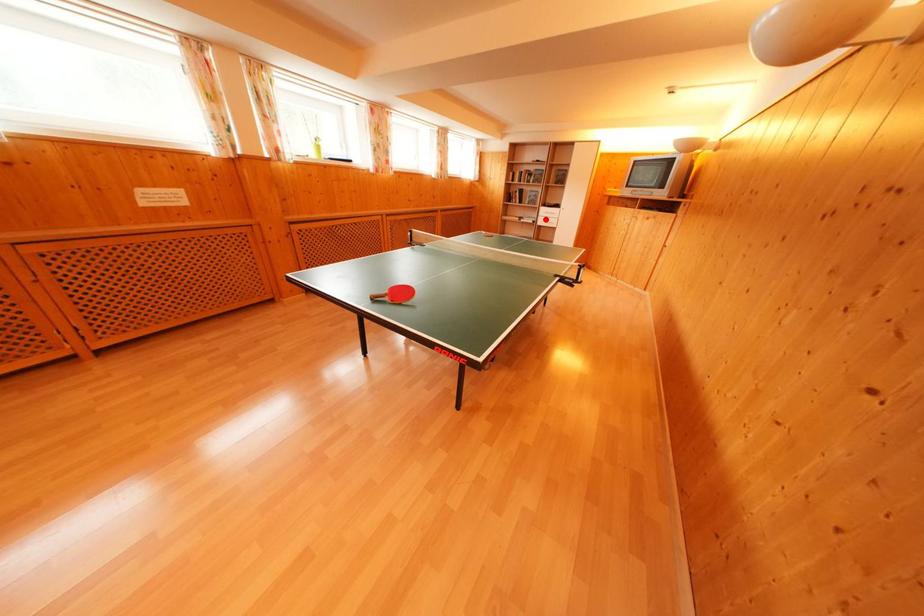
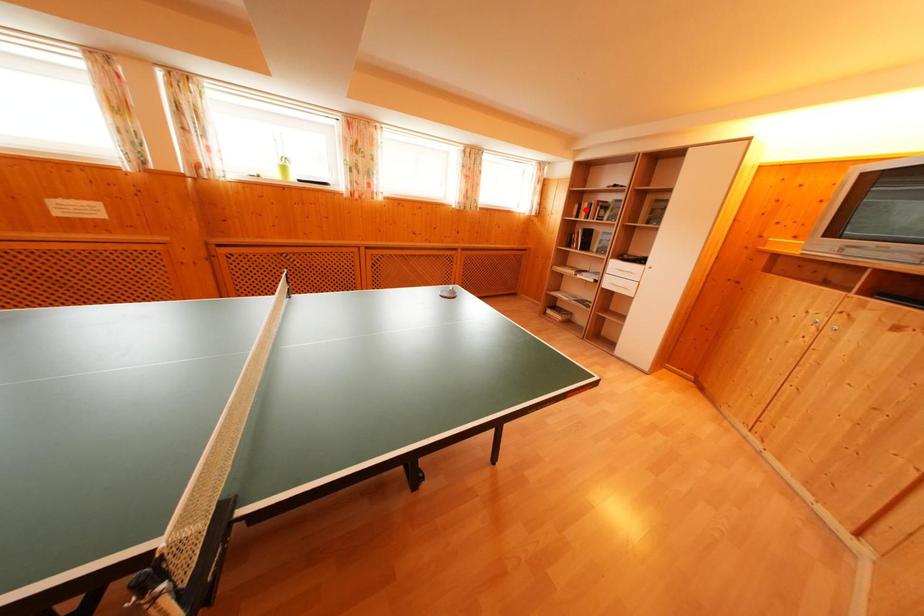
I am providing you with two images of the same scene from different viewpoints. A red point is marked on the first image and another point is marked on the second image. Does the point marked in image1 correspond to the same location as the one in image2?

No